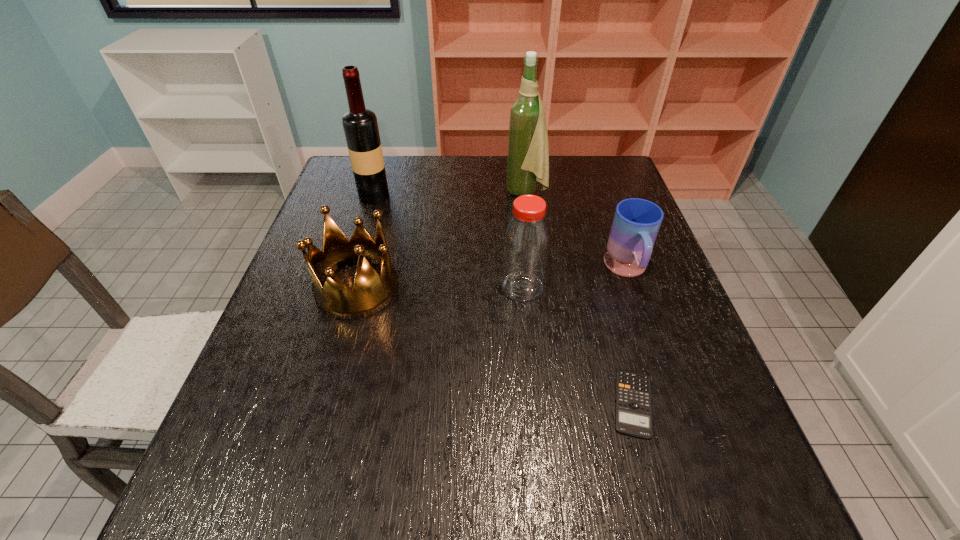
Identify the location of the right wine bottle. The width and height of the screenshot is (960, 540). (528, 149).

Where is `the left wine bottle`? This screenshot has height=540, width=960. the left wine bottle is located at coordinates point(360,125).

The width and height of the screenshot is (960, 540). In order to click on bottle in this screenshot , I will do click(x=526, y=242).

Locate an element on the screen. The image size is (960, 540). crown is located at coordinates (371, 292).

The width and height of the screenshot is (960, 540). Find the location of `mug`. mug is located at coordinates (636, 223).

At what (x,y) coordinates should I click in order to perform the action: click on calculator. Please return your answer as a coordinate pair (x, y). The height and width of the screenshot is (540, 960). Looking at the image, I should click on (633, 415).

Identify the location of the nearest object. The height and width of the screenshot is (540, 960). (633, 415).

I want to click on vacant space located 0.280m on the front-facing side of the right wine bottle, so click(413, 192).

The image size is (960, 540). In order to click on vacant region located on the front-facing side of the right wine bottle in this screenshot , I will do `click(456, 192)`.

I want to click on vacant area situated 0.220m on the front-facing side of the right wine bottle, so click(432, 192).